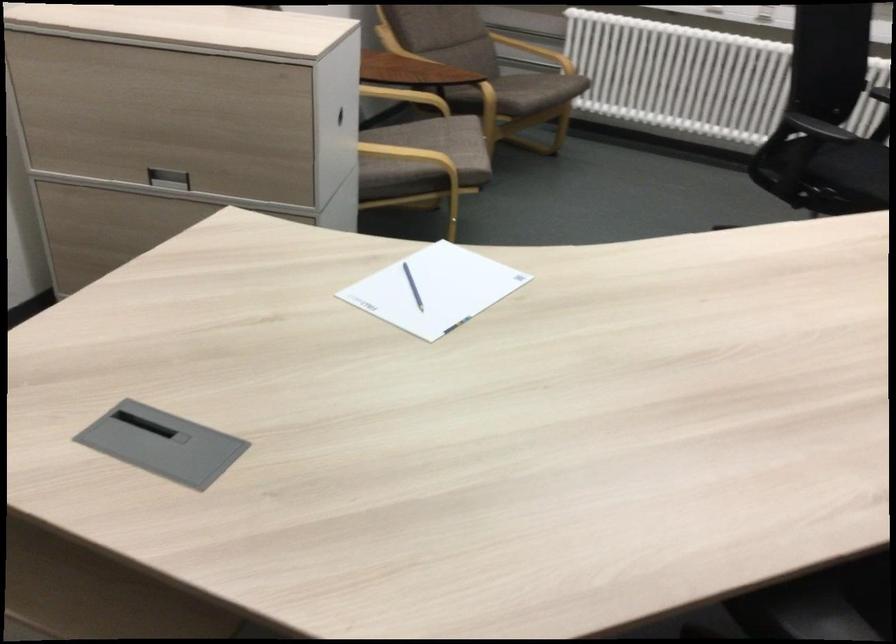
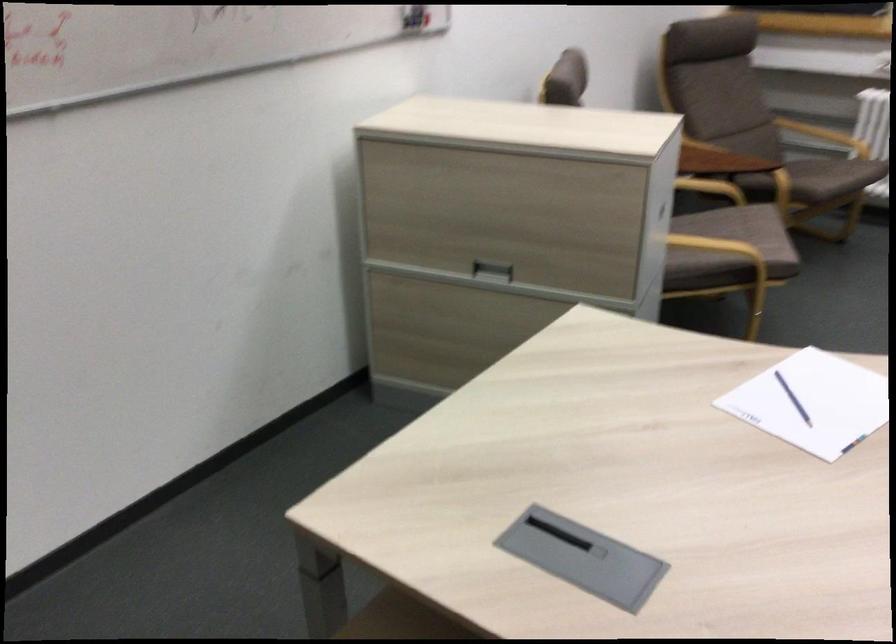
Question: How did the camera likely rotate?

Choices:
 (A) Left
 (B) Right
 (C) Up
 (D) Down

Answer: (A)